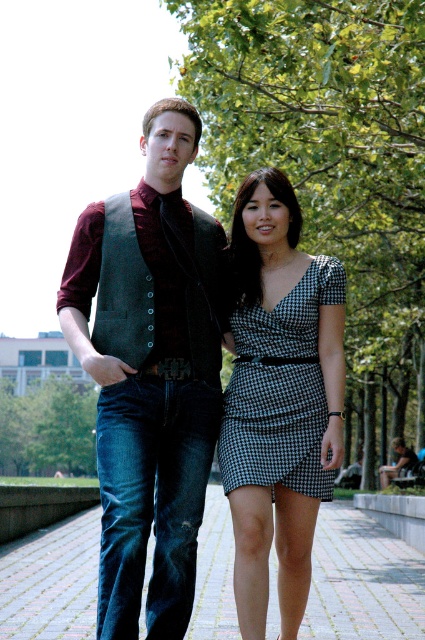
Question: Can you confirm if brick pavement at lower center is positioned to the left of black houndstooth dress at center?

Choices:
 (A) no
 (B) yes

Answer: (B)

Question: Which of the following is the farthest from the observer?

Choices:
 (A) brick pavement at lower center
 (B) houndstooth fabric dress at center

Answer: (A)

Question: Can you confirm if velvet vest at center is thinner than houndstooth fabric dress at center?

Choices:
 (A) no
 (B) yes

Answer: (A)

Question: Which of these objects is positioned farthest from the black houndstooth dress at center?

Choices:
 (A) brick pavement at lower center
 (B) velvet vest at center

Answer: (A)

Question: Can you confirm if houndstooth fabric dress at center is thinner than black houndstooth dress at center?

Choices:
 (A) yes
 (B) no

Answer: (A)

Question: Estimate the real-world distances between objects in this image. Which object is closer to the velvet vest at center?

Choices:
 (A) black houndstooth dress at center
 (B) brick pavement at lower center
 (C) houndstooth fabric dress at center

Answer: (C)